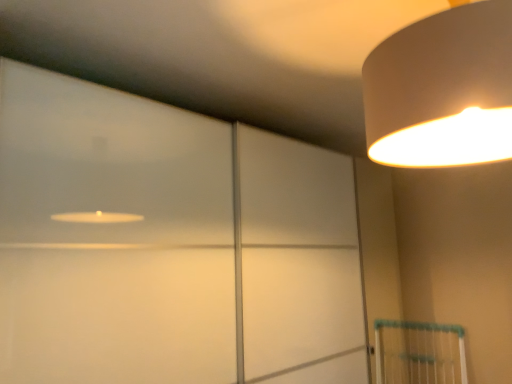
Question: Visually, is white matte lampshade at upper right positioned to the left or to the right of transparent glass door at upper left?

Choices:
 (A) right
 (B) left

Answer: (A)

Question: Relative to transparent glass door at upper left, is white matte lampshade at upper right in front or behind?

Choices:
 (A) front
 (B) behind

Answer: (A)

Question: Considering the positions of white matte lampshade at upper right and transparent glass door at upper left in the image, is white matte lampshade at upper right wider or thinner than transparent glass door at upper left?

Choices:
 (A) wide
 (B) thin

Answer: (A)

Question: From a real-world perspective, is transparent glass door at upper left physically located above or below white matte lampshade at upper right?

Choices:
 (A) below
 (B) above

Answer: (A)

Question: Considering the relative positions of transparent glass door at upper left and white matte lampshade at upper right in the image provided, is transparent glass door at upper left to the left or to the right of white matte lampshade at upper right?

Choices:
 (A) right
 (B) left

Answer: (B)

Question: In terms of width, does transparent glass door at upper left look wider or thinner when compared to white matte lampshade at upper right?

Choices:
 (A) thin
 (B) wide

Answer: (A)

Question: Is transparent glass door at upper left in front of or behind white matte lampshade at upper right in the image?

Choices:
 (A) behind
 (B) front

Answer: (A)